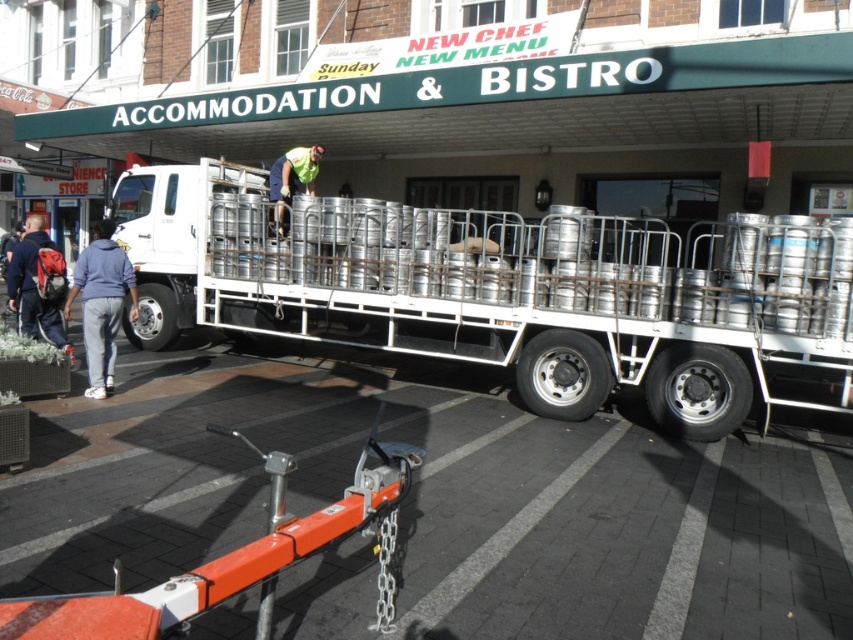
Question: Considering the real-world distances, which object is farthest from the green reflective vest at center?

Choices:
 (A) denim jacket at left
 (B) metallic silver kegs at center

Answer: (A)

Question: Which object is farther from the camera taking this photo?

Choices:
 (A) denim jacket at left
 (B) green reflective vest at center
 (C) metallic silver kegs at center
 (D) blue fleece jacket at lower left

Answer: (B)

Question: Is metallic silver kegs at center positioned behind green reflective vest at center?

Choices:
 (A) no
 (B) yes

Answer: (A)

Question: Does blue fleece jacket at lower left appear on the left side of denim jacket at left?

Choices:
 (A) yes
 (B) no

Answer: (B)

Question: Which point is farther to the camera?

Choices:
 (A) (296, 252)
 (B) (280, 168)
 (C) (30, 298)
 (D) (100, 380)

Answer: (B)

Question: Is metallic silver kegs at center smaller than green reflective vest at center?

Choices:
 (A) yes
 (B) no

Answer: (B)